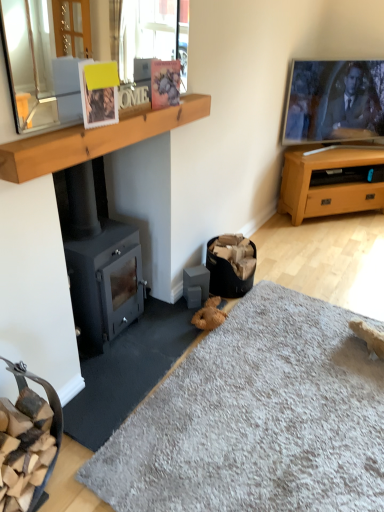
Find the location of a particular element. This screenshot has width=384, height=512. free spot below wooden at upper center (from a real-world perspective) is located at coordinates (131, 350).